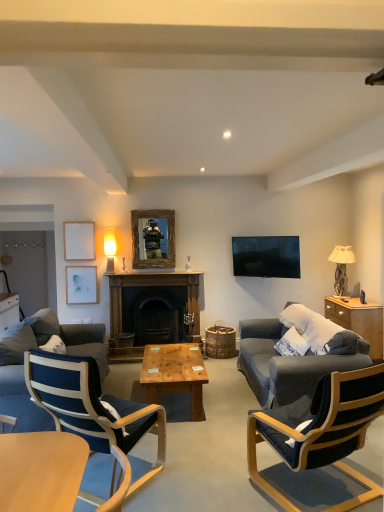
In order to click on vacant area located to the right-hand side of blue fabric chair at lower left, which is counted as the 2th chair, starting from the right in this screenshot , I will do `click(196, 474)`.